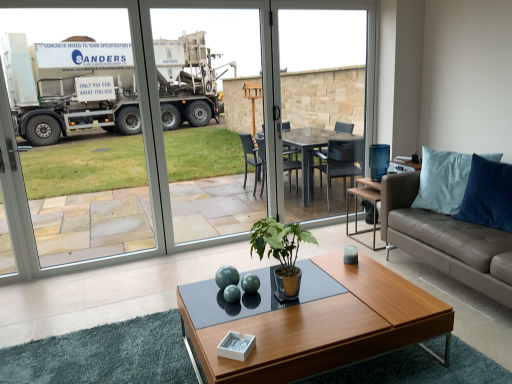
Where is `vacant area that is situated to the right of green glossy plant at center`? vacant area that is situated to the right of green glossy plant at center is located at coordinates (349, 301).